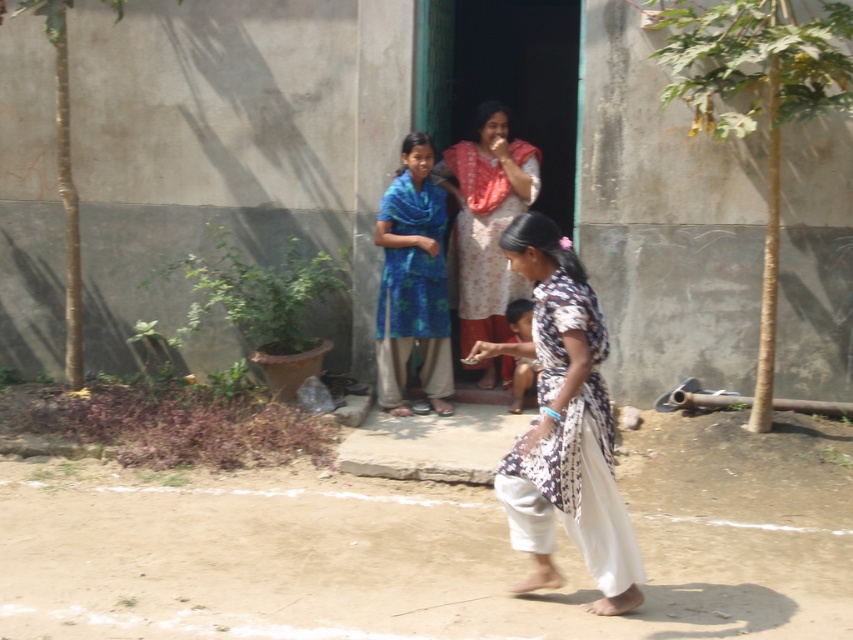
Question: Does blue fabric dress at center have a smaller size compared to floral cotton dress at center?

Choices:
 (A) no
 (B) yes

Answer: (B)

Question: Among these objects, which one is nearest to the camera?

Choices:
 (A) floral-patterned fabric at center
 (B) blue fabric dress at center
 (C) floral cotton dress at center

Answer: (A)

Question: Which is farther from the blue fabric dress at center?

Choices:
 (A) floral-patterned fabric at center
 (B) floral cotton dress at center

Answer: (A)

Question: Which point is closer to the camera?

Choices:
 (A) floral cotton dress at center
 (B) blue fabric dress at center

Answer: (B)

Question: Is floral-patterned fabric at center thinner than blue fabric dress at center?

Choices:
 (A) yes
 (B) no

Answer: (B)

Question: Does floral-patterned fabric at center have a larger size compared to blue fabric dress at center?

Choices:
 (A) yes
 (B) no

Answer: (A)